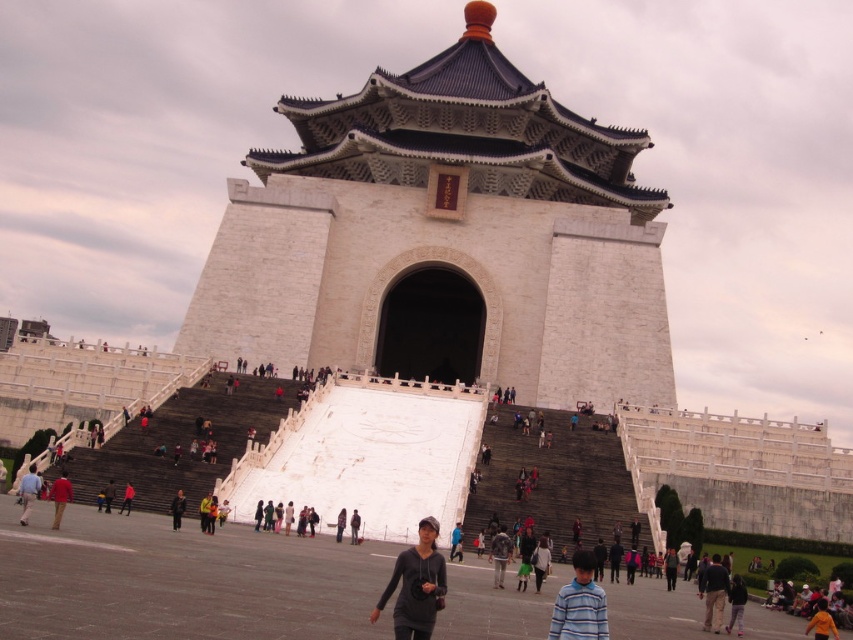
Question: Which object is the farthest from the dark blue jeans at center?

Choices:
 (A) dark gray fabric jacket at lower center
 (B) gray fabric jacket at center

Answer: (A)

Question: Does dark gray sweater at lower left appear over red fabric jacket at lower left?

Choices:
 (A) no
 (B) yes

Answer: (B)

Question: Estimate the real-world distances between objects in this image. Which object is closer to the dark gray sweater at lower right?

Choices:
 (A) red cotton shirt at lower left
 (B) gray fabric jacket at center

Answer: (B)

Question: Considering the relative positions of dark blue jeans at lower right and dark gray sweater at lower right in the image provided, where is dark blue jeans at lower right located with respect to dark gray sweater at lower right?

Choices:
 (A) above
 (B) below

Answer: (B)

Question: Based on their relative distances, which object is nearer to the dark gray sweater at lower left?

Choices:
 (A) black matte jacket at center
 (B) dark blue jeans at center
 (C) dark gray sweater at center
 (D) orange fabric at lower right

Answer: (B)

Question: Is striped shirt at lower right closer to camera compared to dark gray sweater at lower right?

Choices:
 (A) yes
 (B) no

Answer: (A)